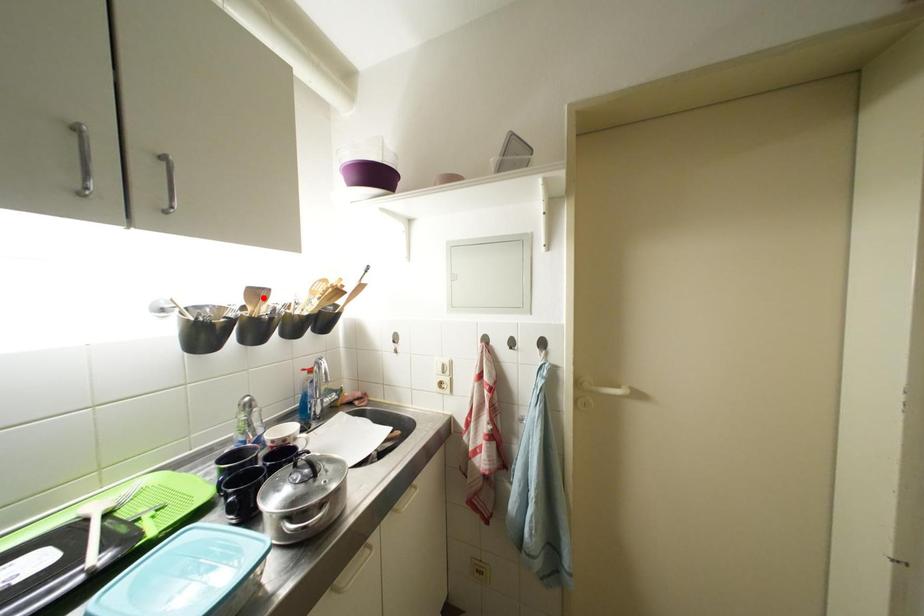
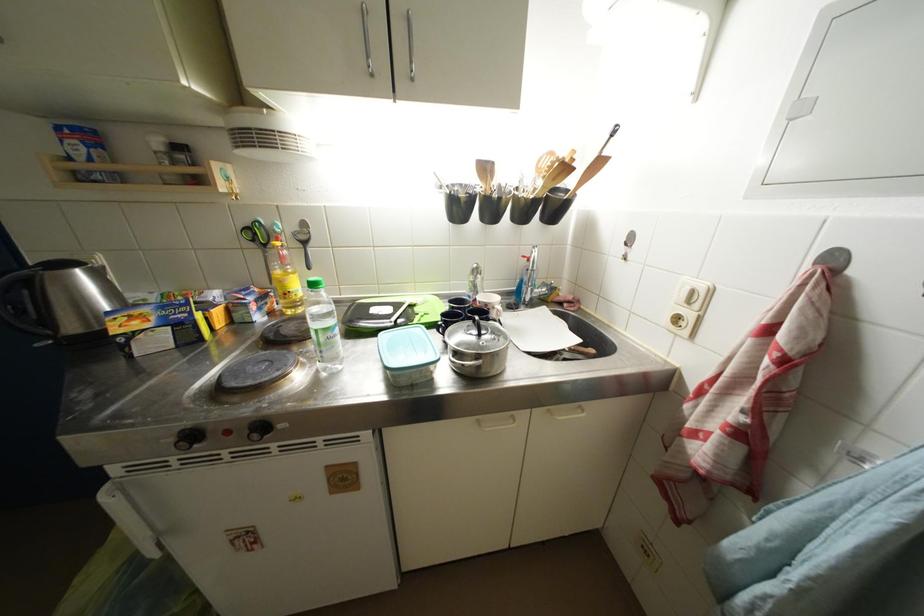
The point at the highlighted location is marked in the first image. Where is the corresponding point in the second image?

(492, 172)